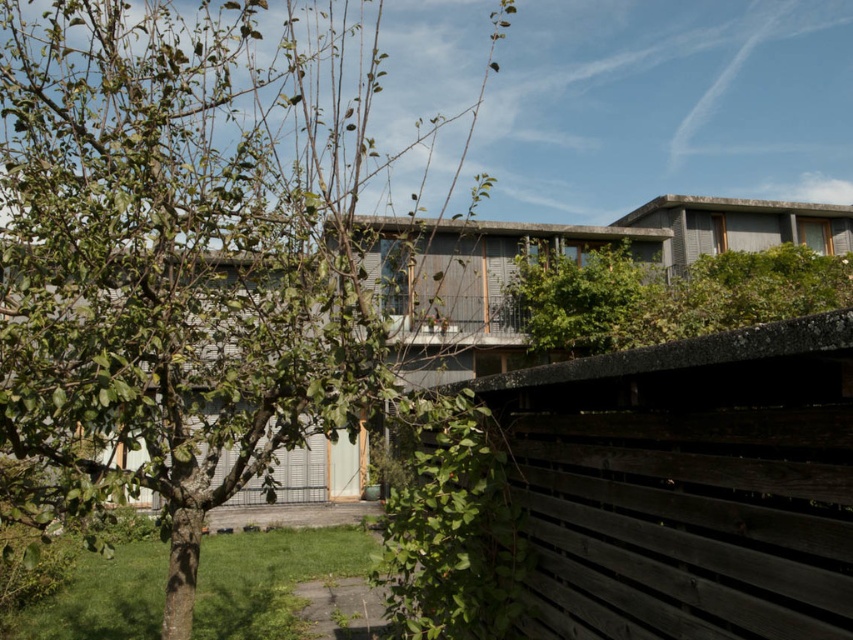
You are standing in front of the modern architectural structure and want to take a photo of the green leafy tree at center. If your camera has a maximum focus range of 10 feet, will you be able to capture the tree clearly?

The green leafy tree at center is 11.50 feet away from the camera, which exceeds the maximum focus range of 10 feet. Therefore, the tree will not be in clear focus.

You are standing in front of the modern building and want to see the entire facade without obstruction. Based on the scene, which object between the green leafy tree at center and the dark gray wooden fence at center is taller and thus might block your view?

The green leafy tree at center is taller than the dark gray wooden fence at center, so it might block your view of the building facade.

You are a photographer trying to capture the modern building in the background. You notice the green leafy tree at center and the dark gray wooden fence at center. Which object is blocking your view of the building more? Please explain based on their positions.

The green leafy tree at center is above the dark gray wooden fence at center, so the tree is blocking more of the upper part of the building while the fence blocks the lower part. However, since the tree is positioned higher up, it might obstruct more of the building from a photographer capturing the entire structure.